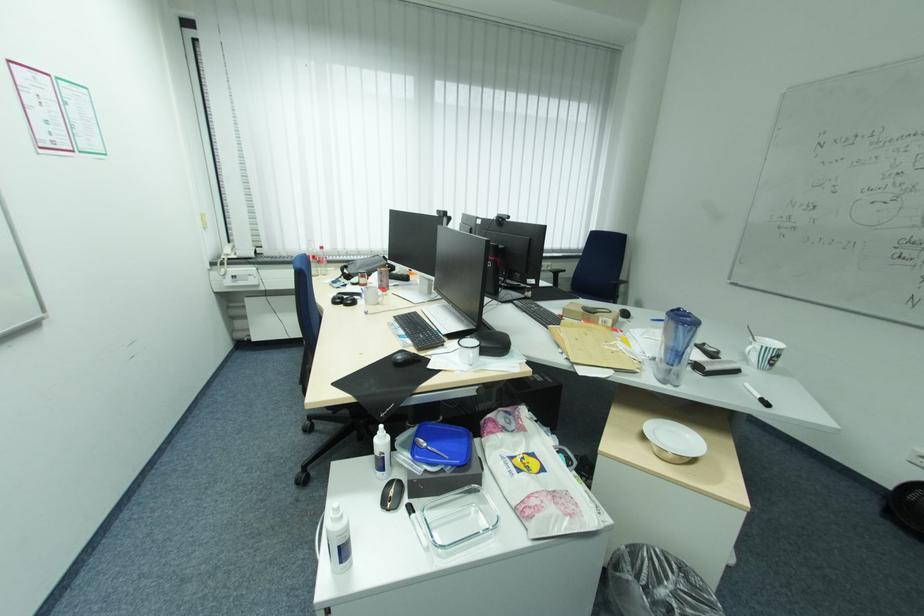
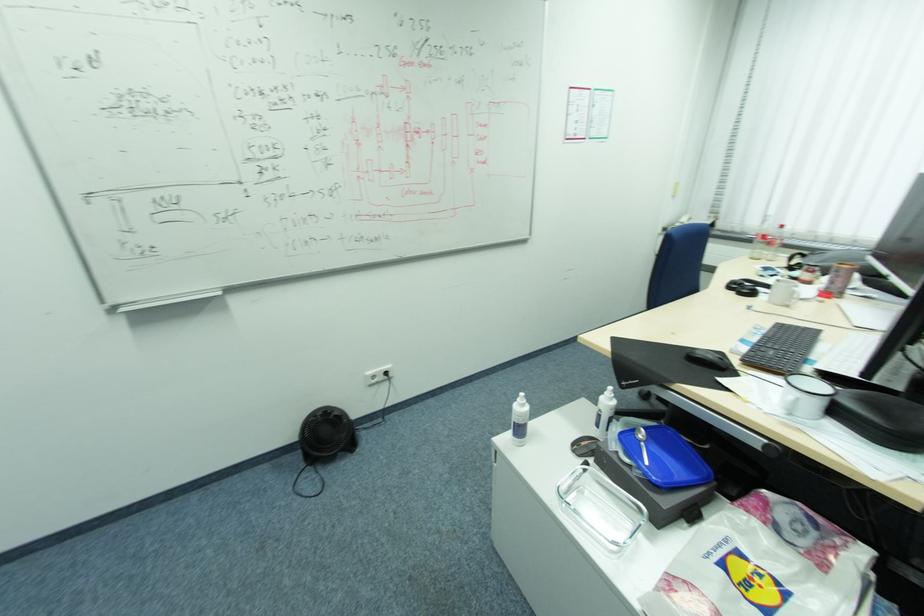
The point at (406, 361) is marked in the first image. Where is the corresponding point in the second image?

(699, 355)